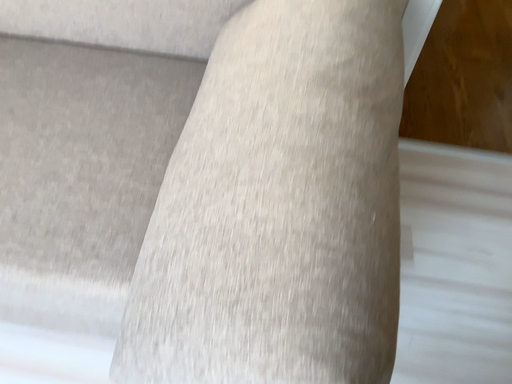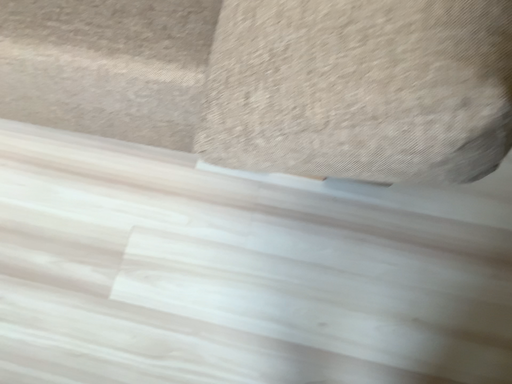
Question: How did the camera likely rotate when shooting the video?

Choices:
 (A) rotated upward
 (B) rotated downward

Answer: (B)